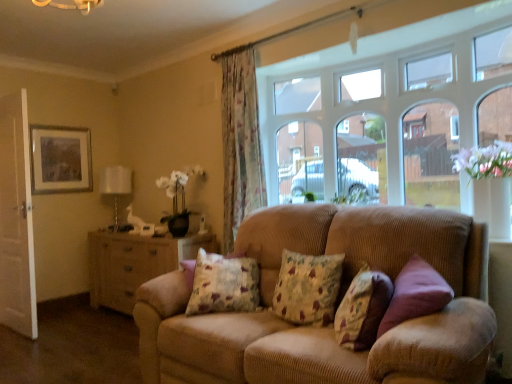
Question: Which direction should I rotate to face floral fabric cushion at center, arranged as the first pillow when viewed from the left, — up or down?

Choices:
 (A) down
 (B) up

Answer: (A)

Question: Is corduroy couch at center next to floral fabric cushion at center, marked as the 2th pillow in a right-to-left arrangement, and touching it?

Choices:
 (A) yes
 (B) no

Answer: (B)

Question: Is corduroy couch at center positioned beyond the bounds of floral fabric cushion at center, acting as the second pillow starting from the left?

Choices:
 (A) yes
 (B) no

Answer: (A)

Question: Considering the relative sizes of corduroy couch at center and floral fabric cushion at center, marked as the 2th pillow in a right-to-left arrangement, in the image provided, is corduroy couch at center bigger than floral fabric cushion at center, marked as the 2th pillow in a right-to-left arrangement,?

Choices:
 (A) yes
 (B) no

Answer: (A)

Question: From the image's perspective, would you say corduroy couch at center is shown under floral fabric cushion at center, marked as the 2th pillow in a right-to-left arrangement?

Choices:
 (A) no
 (B) yes

Answer: (B)

Question: Is corduroy couch at center behind floral fabric cushion at center, acting as the second pillow starting from the left?

Choices:
 (A) no
 (B) yes

Answer: (A)

Question: Does corduroy couch at center have a greater width compared to floral fabric cushion at center, acting as the second pillow starting from the left?

Choices:
 (A) no
 (B) yes

Answer: (B)

Question: From a real-world perspective, is corduroy couch at center on top of white wooden door at left?

Choices:
 (A) no
 (B) yes

Answer: (A)

Question: Considering the relative positions of corduroy couch at center and white wooden door at left in the image provided, is corduroy couch at center in front of white wooden door at left?

Choices:
 (A) no
 (B) yes

Answer: (B)

Question: Could you tell me if corduroy couch at center is facing white wooden door at left?

Choices:
 (A) yes
 (B) no

Answer: (B)

Question: From the image's perspective, does corduroy couch at center appear lower than white wooden door at left?

Choices:
 (A) no
 (B) yes

Answer: (B)

Question: Is corduroy couch at center far away from white wooden door at left?

Choices:
 (A) yes
 (B) no

Answer: (A)

Question: Considering the relative sizes of corduroy couch at center and white wooden door at left in the image provided, is corduroy couch at center shorter than white wooden door at left?

Choices:
 (A) yes
 (B) no

Answer: (A)

Question: Is corduroy couch at center bigger than floral fabric curtain at center?

Choices:
 (A) yes
 (B) no

Answer: (A)